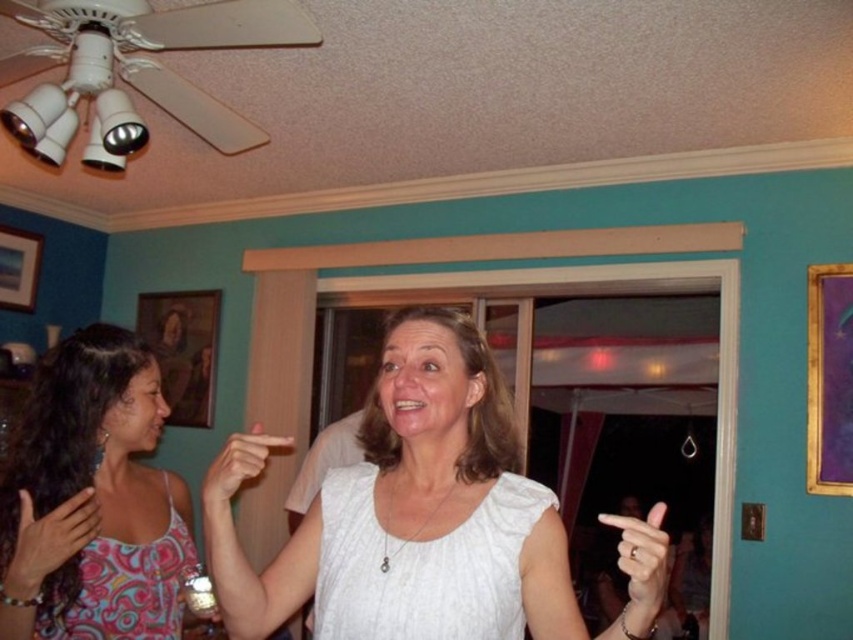
Does white matte dress at center have a smaller size compared to matte pink tank top at center?

Actually, white matte dress at center might be larger than matte pink tank top at center.

What do you see at coordinates (416, 515) in the screenshot? This screenshot has width=853, height=640. I see `white matte dress at center` at bounding box center [416, 515].

What do you see at coordinates (416, 515) in the screenshot? I see `white matte dress at center` at bounding box center [416, 515].

Locate an element on the screen. The image size is (853, 640). white matte dress at center is located at coordinates (416, 515).

Is matte pink hand at lower left above white matte hand at center?

Indeed, matte pink hand at lower left is positioned over white matte hand at center.

Describe the element at coordinates (48, 541) in the screenshot. I see `matte pink hand at lower left` at that location.

Between point (32, 576) and point (624, 497), which one is positioned in front?

Point (32, 576) is in front.

I want to click on matte pink hand at lower left, so click(x=48, y=541).

Is matte pink hand at lower left positioned in front of matte white hand at center?

That is False.

Identify the location of matte pink hand at lower left. The width and height of the screenshot is (853, 640). (48, 541).